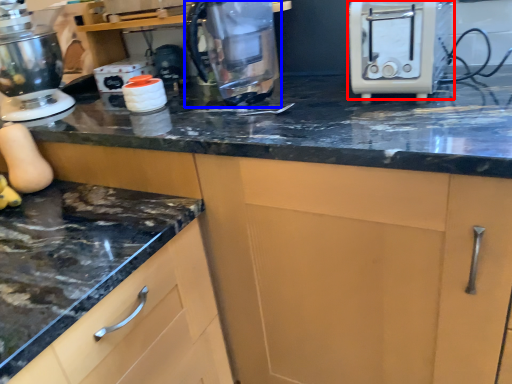
Question: Which object is further to the camera taking this photo, toaster (highlighted by a red box) or kitchen appliance (highlighted by a blue box)?

Choices:
 (A) toaster
 (B) kitchen appliance

Answer: (B)